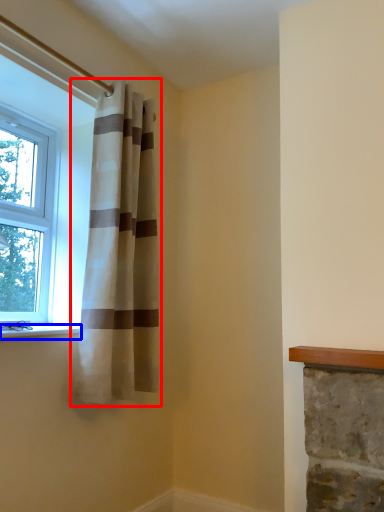
Question: Among these objects, which one is nearest to the camera, curtain (highlighted by a red box) or window sill (highlighted by a blue box)?

Choices:
 (A) curtain
 (B) window sill

Answer: (B)